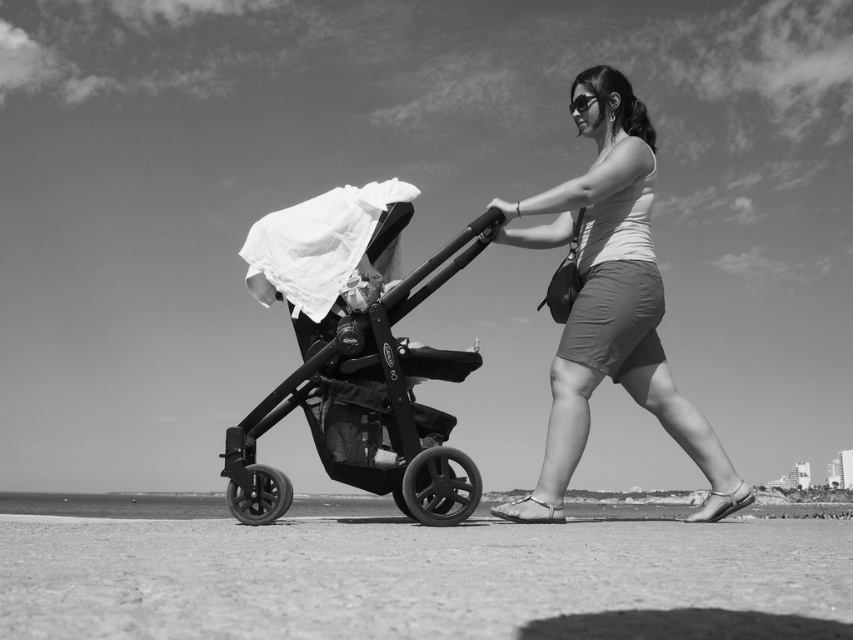
In the scene shown: You are a photographer standing at the edge of the beach. You want to take a photo of the woman pushing the stroller without including the smooth sand at lower center in the frame. Based on the scene description, what is the minimum distance you should step back from your current position to achieve this?

The smooth sand at lower center is 1.72 meters away from the camera. To exclude it from the frame, you should step back at least 1.72 meters so that the sand is no longer in the camera view.

You are a photographer trying to capture a clear shot of the matte white tank top at center while the black matte baby carriage at center is also in the frame. Can you position yourself so that the baby carriage doesn not block the view of the tank top?

The black matte baby carriage at center is in front of the matte white tank top at center, so positioning yourself to avoid the carriage blocking the tank top would require moving to a position where the carriage is no longer between you and the tank top. However, since the carriage is already in front, it will block the view unless you move around it or adjust your angle to see the tank top from the side or behind the carriage.

You are a photographer trying to capture a shot of the black matte baby carriage at center and the matte white tank top at center. If you want to ensure both objects are fully visible in the frame without cropping, which object should you position closer to the camera to maintain their sizes?

The black matte baby carriage at center has a smaller width than the matte white tank top at center. To maintain their sizes in the photo, you should position the black matte baby carriage at center closer to the camera so it appears larger, while keeping the matte white tank top at center further back to avoid dominating the frame.